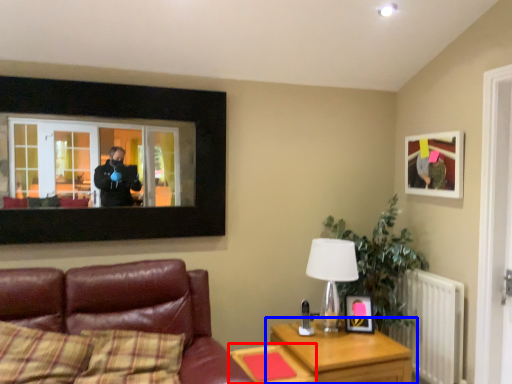
Question: Which of the following is the farthest to the observer, table (highlighted by a red box) or table (highlighted by a blue box)?

Choices:
 (A) table
 (B) table

Answer: (B)